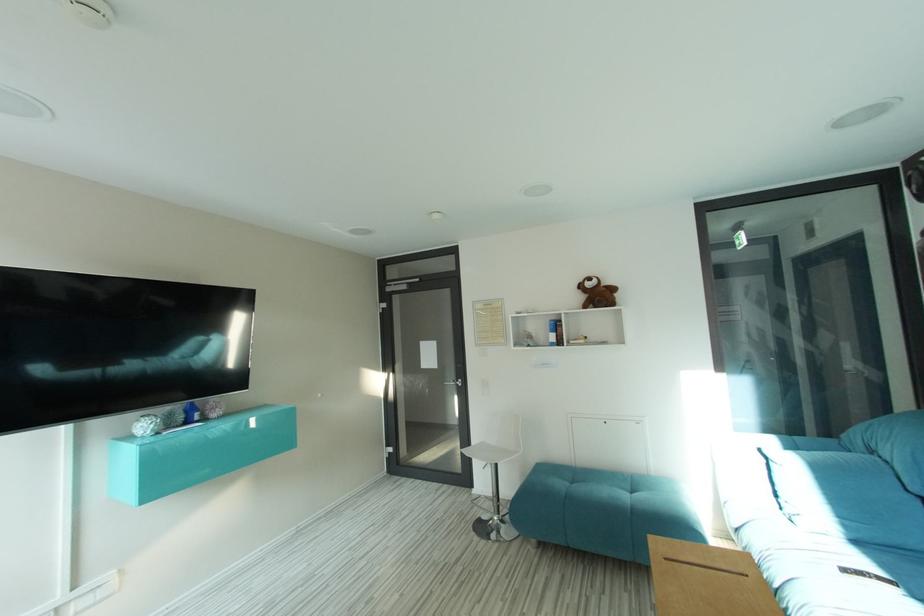
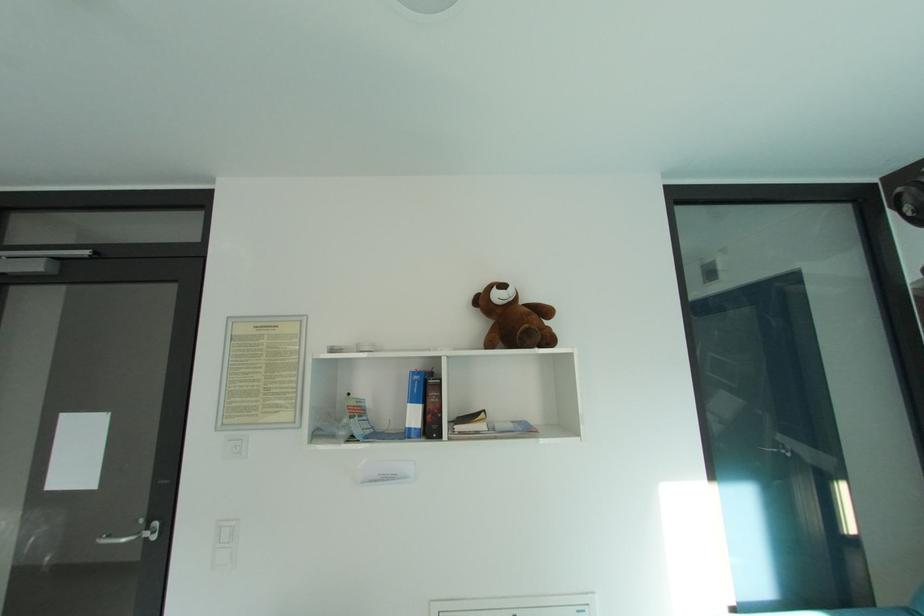
Question: Which direction would the cameraman need to move to produce the second image? Reply with the corresponding letter.

Choices:
 (A) Left
 (B) Right
 (C) Forward
 (D) Backward

Answer: (C)